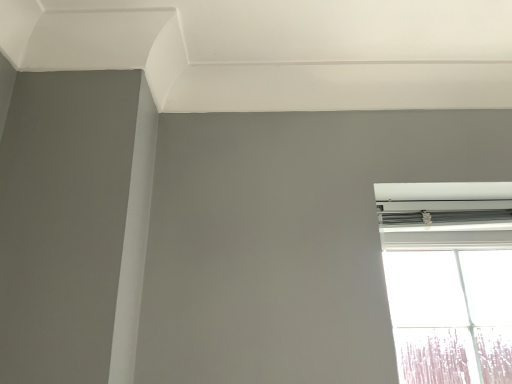
Locate an element on the screen. white matte blind at upper right is located at coordinates [x=443, y=217].

What do you see at coordinates (443, 217) in the screenshot?
I see `white matte blind at upper right` at bounding box center [443, 217].

Find the location of a particular element. This screenshot has height=384, width=512. white matte blind at upper right is located at coordinates (443, 217).